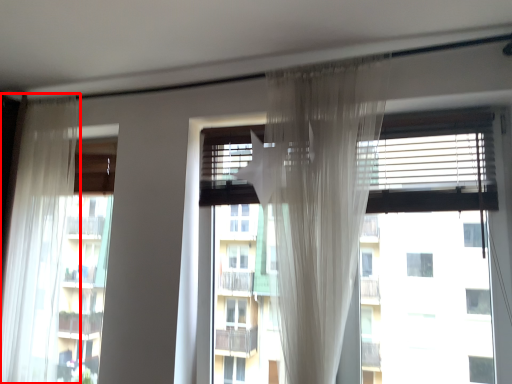
Question: Observing the image, what is the correct spatial positioning of curtain (annotated by the red box) in reference to window?

Choices:
 (A) left
 (B) right

Answer: (A)